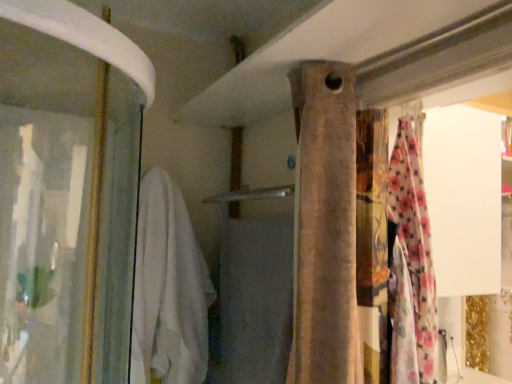
In order to face beige fabric curtain at center, should I rotate leftwards or rightwards?

To face it directly, rotate right by 7.774 degrees.

What do you see at coordinates (254, 302) in the screenshot?
I see `white soft towel at center` at bounding box center [254, 302].

I want to click on beige fabric curtain at center, so click(325, 227).

Measure the distance between white soft towel at center and beige fabric curtain at center.

white soft towel at center and beige fabric curtain at center are 12.12 inches apart.

Is white soft towel at center oriented towards beige fabric curtain at center?

No, white soft towel at center is not facing towards beige fabric curtain at center.

Between white soft towel at center and beige fabric curtain at center, which one has larger width?

With larger width is beige fabric curtain at center.

In the scene shown: Is white soft towel at center next to beige fabric curtain at center?

white soft towel at center and beige fabric curtain at center are not in contact.

From a real-world perspective, is white soft towel at center physically below white soft towel at left?

Yes, from a real-world perspective, white soft towel at center is below white soft towel at left.

Visually, is white soft towel at center positioned to the left or to the right of white soft towel at left?

From the image, it's evident that white soft towel at center is to the right of white soft towel at left.

Where is `bath towel in front of the white soft towel at left`? bath towel in front of the white soft towel at left is located at coordinates (254, 302).

Who is bigger, white soft towel at center or white soft towel at left?

Bigger between the two is white soft towel at left.

Between point (147, 180) and point (355, 321), which one is positioned behind?

The point (147, 180) is behind.

Measure the distance between white soft towel at left and beige fabric curtain at center.

white soft towel at left is 62.92 centimeters from beige fabric curtain at center.

The image size is (512, 384). I want to click on curtain in front of the white soft towel at left, so click(325, 227).

From a real-world perspective, is white soft towel at left below beige fabric curtain at center?

Yes, from a real-world perspective, white soft towel at left is below beige fabric curtain at center.

Is point (330, 76) positioned after point (181, 200)?

That is False.

Consider the image. Is beige fabric curtain at center at the right side of white soft towel at left?

Indeed, beige fabric curtain at center is positioned on the right side of white soft towel at left.

Based on their sizes in the image, would you say beige fabric curtain at center is bigger or smaller than white soft towel at left?

In the image, beige fabric curtain at center appears to be smaller than white soft towel at left.

Is beige fabric curtain at center oriented away from white soft towel at left?

beige fabric curtain at center does not have its back to white soft towel at left.

At what (x,y) coordinates should I click in order to perform the action: click on curtain above the white soft towel at center (from the image's perspective). Please return your answer as a coordinate pair (x, y). This screenshot has width=512, height=384. Looking at the image, I should click on coord(325,227).

From the image's perspective, is beige fabric curtain at center positioned above or below white soft towel at center?

beige fabric curtain at center is situated higher than white soft towel at center in the image.

Which point is more forward, (304,184) or (264,329)?

The point (304,184) is more forward.

Which of these two, beige fabric curtain at center or white soft towel at center, is thinner?

With smaller width is white soft towel at center.

Based on the photo, from the image's perspective, is white soft towel at left located beneath white soft towel at center?

Actually, white soft towel at left appears above white soft towel at center in the image.

Who is taller, white soft towel at left or white soft towel at center?

white soft towel at left is taller.

Based on the photo, is white soft towel at center surrounded by white soft towel at left?

Yes, white soft towel at center can be found within white soft towel at left.

How different are the orientations of white soft towel at left and white soft towel at center in degrees?

They differ by 88 degrees in their facing directions.

Locate an element on the screen. The width and height of the screenshot is (512, 384). curtain above the white soft towel at center (from the image's perspective) is located at coordinates (325, 227).

The width and height of the screenshot is (512, 384). I want to click on clothing behind the white soft towel at center, so click(168, 289).

Looking at this image, looking at the image, which one is located further to white soft towel at center, beige fabric curtain at center or white soft towel at left?

beige fabric curtain at center lies further to white soft towel at center than the other object.

Looking at the image, which one is located closer to white soft towel at left, beige fabric curtain at center or white soft towel at center?

The object closer to white soft towel at left is white soft towel at center.

Considering their positions, is white soft towel at left positioned closer to white soft towel at center than beige fabric curtain at center?

white soft towel at left lies closer to white soft towel at center than the other object.

Which object lies nearer to the anchor point beige fabric curtain at center, white soft towel at center or white soft towel at left?

Among the two, white soft towel at center is located nearer to beige fabric curtain at center.

When comparing their distances from white soft towel at left, does white soft towel at center or beige fabric curtain at center seem closer?

The object closer to white soft towel at left is white soft towel at center.

Based on their spatial positions, is white soft towel at left or white soft towel at center further from beige fabric curtain at center?

Based on the image, white soft towel at left appears to be further to beige fabric curtain at center.

This screenshot has height=384, width=512. I want to click on bath towel between white soft towel at left and beige fabric curtain at center, so click(254, 302).